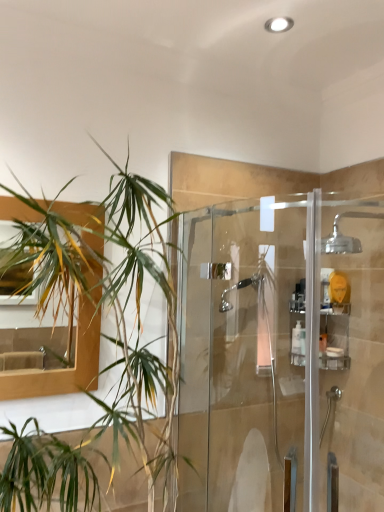
Question: Would you say green leafy plant at left is to the left or to the right of white plastic bottle at center in the picture?

Choices:
 (A) right
 (B) left

Answer: (B)

Question: Considering the positions of point (140, 354) and point (297, 330), is point (140, 354) closer or farther from the camera than point (297, 330)?

Choices:
 (A) farther
 (B) closer

Answer: (B)

Question: Considering the real-world distances, which object is closest to the clear plastic shelf at upper right?

Choices:
 (A) white plastic bottle at center
 (B) clear glass shower door at center
 (C) green leafy plant at left
 (D) chrome metallic showerhead at upper right

Answer: (A)

Question: Based on their relative distances, which object is farther from the chrome metallic showerhead at upper right?

Choices:
 (A) clear glass shower door at center
 (B) clear plastic shelf at upper right
 (C) green leafy plant at left
 (D) white plastic bottle at center

Answer: (C)